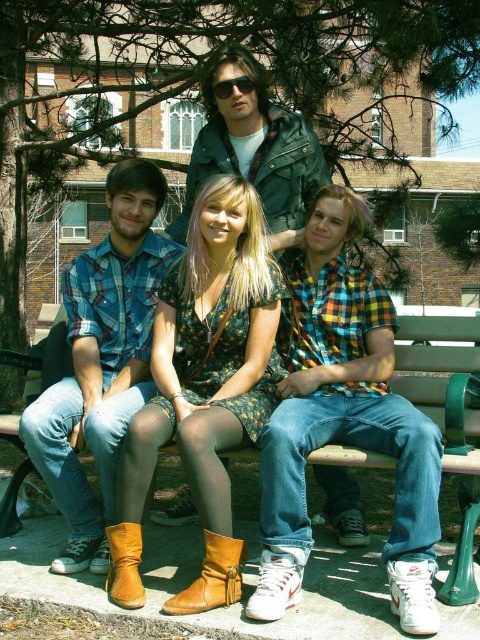
Is plaid cotton shirt at center bigger than brown leather boot at lower center?

Yes.

Does plaid cotton shirt at center appear under brown leather boot at lower center?

No.

Does point (352, 429) lie in front of point (227, 556)?

No, it is behind (227, 556).

You are a GUI agent. You are given a task and a screenshot of the screen. Output one action in this format:
    pyautogui.click(x=<x>, y=<y>)
    Task: Click on the plaid cotton shirt at center
    
    Given the screenshot: What is the action you would take?
    pyautogui.click(x=344, y=420)

Does plaid cotton shirt at center appear on the right side of floral dress at center?

Yes, plaid cotton shirt at center is to the right of floral dress at center.

Who is higher up, plaid cotton shirt at center or floral dress at center?

plaid cotton shirt at center is higher up.

Does point (300, 316) come behind point (242, 396)?

That is True.

Locate an element on the screen. plaid cotton shirt at center is located at coordinates (344, 420).

Which of these two, wooden bench at center or brown leather boot at lower center, stands taller?

With more height is wooden bench at center.

Who is shorter, wooden bench at center or brown leather boot at lower center?

Standing shorter between the two is brown leather boot at lower center.

Find the location of a particular element. wooden bench at center is located at coordinates (447, 417).